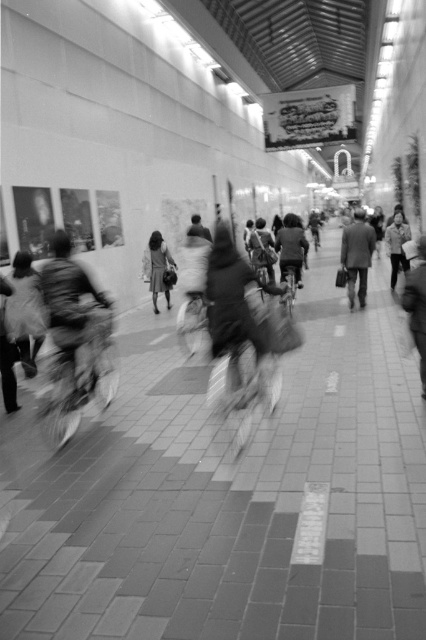
Question: In this image, where is smooth fabric bag at left located relative to matte black bicycle at center?

Choices:
 (A) above
 (B) below

Answer: (B)

Question: Is matte fabric backpack at center closer to the viewer compared to dark gray suit at center?

Choices:
 (A) yes
 (B) no

Answer: (A)

Question: Which point appears farthest from the camera in this image?

Choices:
 (A) (20, 298)
 (B) (386, 237)
 (C) (143, 259)
 (D) (293, 257)

Answer: (B)

Question: Is dark gray suit at center bigger than matte black coat at center?

Choices:
 (A) no
 (B) yes

Answer: (B)

Question: Considering the real-world distances, which object is farthest from the matte black coat at center?

Choices:
 (A) smooth fabric bag at left
 (B) dark gray fabric coat at right
 (C) dark gray suit at center
 (D) matte gray jacket at center

Answer: (B)

Question: Which point appears closest to the camera in this image?

Choices:
 (A) (259, 257)
 (B) (396, 236)
 (C) (20, 326)
 (D) (170, 305)

Answer: (C)